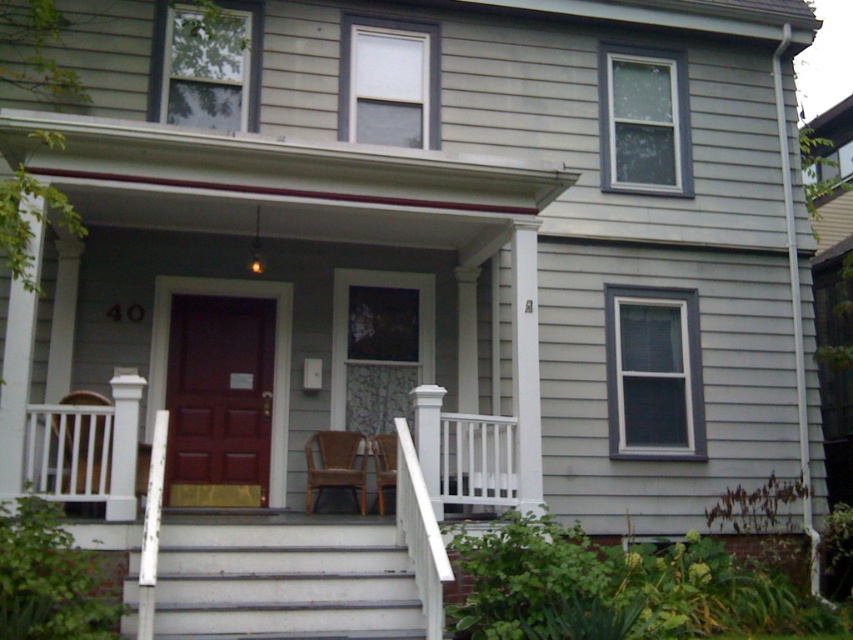
Is white painted wood stairs at lower center positioned behind white wooden chair at lower left?

No.

Between white painted wood stairs at lower center and white wooden chair at lower left, which one has more height?

Standing taller between the two is white wooden chair at lower left.

Image resolution: width=853 pixels, height=640 pixels. I want to click on white painted wood stairs at lower center, so click(285, 582).

Can you confirm if white painted wood stairs at lower center is taller than white painted wood post at center?

Incorrect, white painted wood stairs at lower center's height is not larger of white painted wood post at center's.

Between point (390, 588) and point (428, 429), which one is positioned in front?

Point (390, 588)

Which is in front, point (236, 545) or point (415, 436)?

Positioned in front is point (236, 545).

This screenshot has width=853, height=640. What are the coordinates of `white painted wood stairs at lower center` in the screenshot? It's located at (285, 582).

Which is in front, point (99, 496) or point (426, 468)?

Positioned in front is point (99, 496).

At what (x,y) coordinates should I click in order to perform the action: click on white wooden rail at lower left. Please return your answer as a coordinate pair (x, y). The height and width of the screenshot is (640, 853). Looking at the image, I should click on (84, 452).